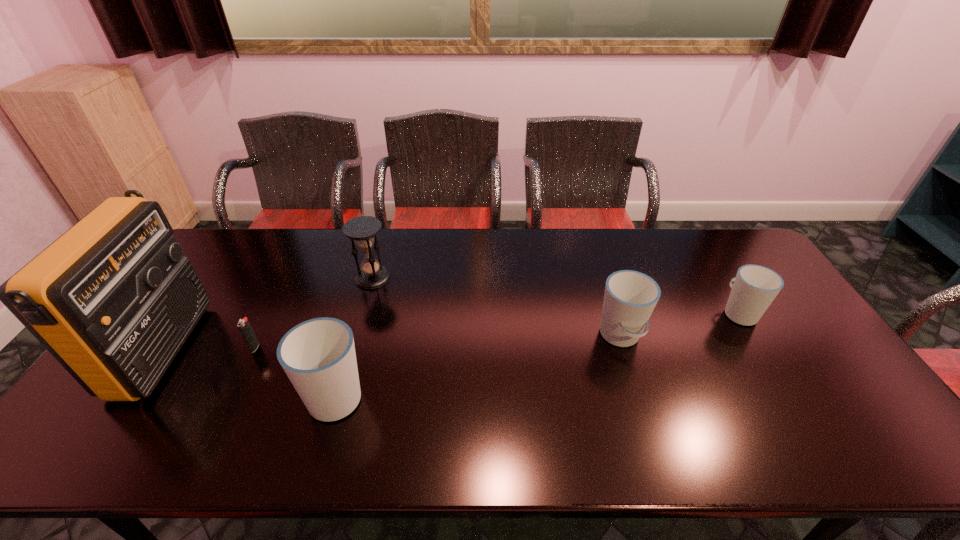
The width and height of the screenshot is (960, 540). Find the location of `vacant region located with a handle on the side of the leftmost cup`. vacant region located with a handle on the side of the leftmost cup is located at coordinates (370, 278).

The height and width of the screenshot is (540, 960). Find the location of `vacant area situated 0.320m with a handle on the side of the leftmost cup`. vacant area situated 0.320m with a handle on the side of the leftmost cup is located at coordinates (368, 285).

Find the location of a particular element. The width and height of the screenshot is (960, 540). free space located with a handle on the side of the leftmost cup is located at coordinates (359, 316).

The width and height of the screenshot is (960, 540). I want to click on free spot located with a handle on the side of the second shortest cup, so click(x=638, y=394).

This screenshot has height=540, width=960. I want to click on vacant area located with a handle on the side of the shortest cup, so click(715, 274).

Where is `vacant space located 0.160m with a handle on the side of the shortest cup`? vacant space located 0.160m with a handle on the side of the shortest cup is located at coordinates (709, 265).

This screenshot has height=540, width=960. What are the coordinates of `vacant space situated 0.330m with a handle on the side of the shortest cup` in the screenshot? It's located at (691, 235).

Locate an element on the screen. This screenshot has height=540, width=960. free space located on the left of the farthest object is located at coordinates (327, 278).

Locate an element on the screen. The width and height of the screenshot is (960, 540). free space located on the front of the shortest object is located at coordinates (226, 408).

Identify the location of vacant area located on the front-facing side of the radio receiver. (300, 350).